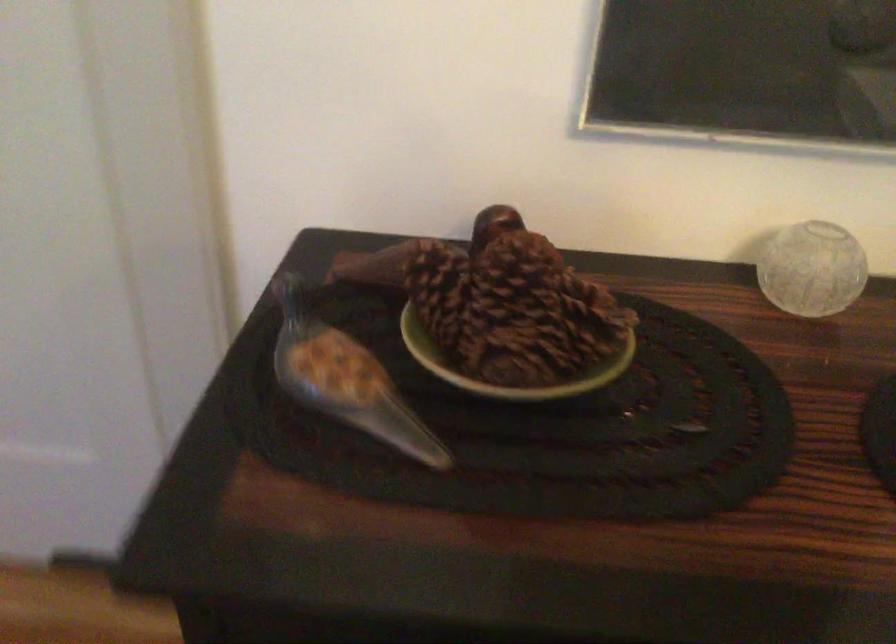
Which object does [812,269] point to?

It corresponds to the small glass sphere in the image.